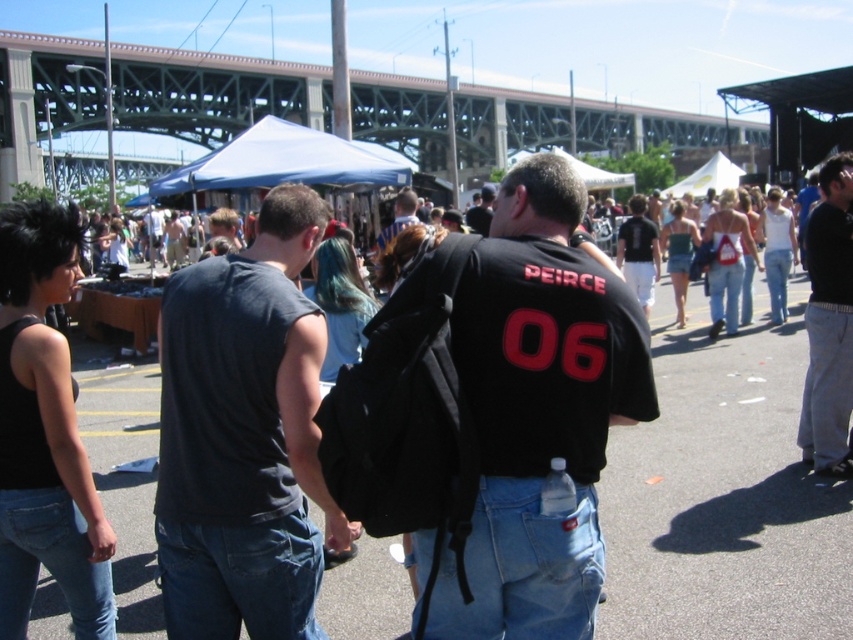
Question: Is gray cotton pants at right bigger than blue denim jeans at center?

Choices:
 (A) yes
 (B) no

Answer: (A)

Question: Which of the following is the farthest from the observer?

Choices:
 (A) blue fabric canopy at upper center
 (B) black matte jersey at center

Answer: (A)

Question: Can you confirm if black matte jersey at center is thinner than gray cotton pants at right?

Choices:
 (A) yes
 (B) no

Answer: (A)

Question: Does gray cotton pants at right have a greater width compared to blue denim jeans at center?

Choices:
 (A) no
 (B) yes

Answer: (B)

Question: Which point is closer to the camera?

Choices:
 (A) (323, 138)
 (B) (573, 284)

Answer: (B)

Question: Considering the real-world distances, which object is closest to the dark gray sleeveless shirt at center?

Choices:
 (A) blue denim jeans at center
 (B) gray cotton pants at right
 (C) blue fabric canopy at upper center
 (D) black matte jersey at center

Answer: (D)